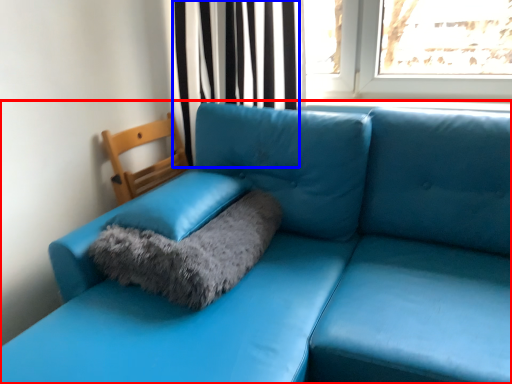
Question: Among these objects, which one is nearest to the camera, studio couch (highlighted by a red box) or curtain (highlighted by a blue box)?

Choices:
 (A) studio couch
 (B) curtain

Answer: (A)